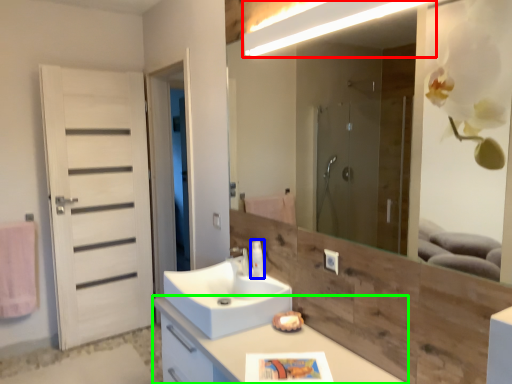
Question: Which object is the farthest from light fixture (highlighted by a red box)? Choose among these: soap dispenser (highlighted by a blue box) or bathroom cabinet (highlighted by a green box).

Choices:
 (A) soap dispenser
 (B) bathroom cabinet

Answer: (B)